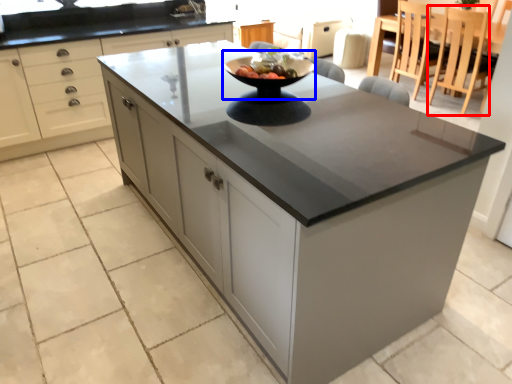
Question: Which object appears closest to the camera in this image, chair (highlighted by a red box) or mixing bowl (highlighted by a blue box)?

Choices:
 (A) chair
 (B) mixing bowl

Answer: (B)